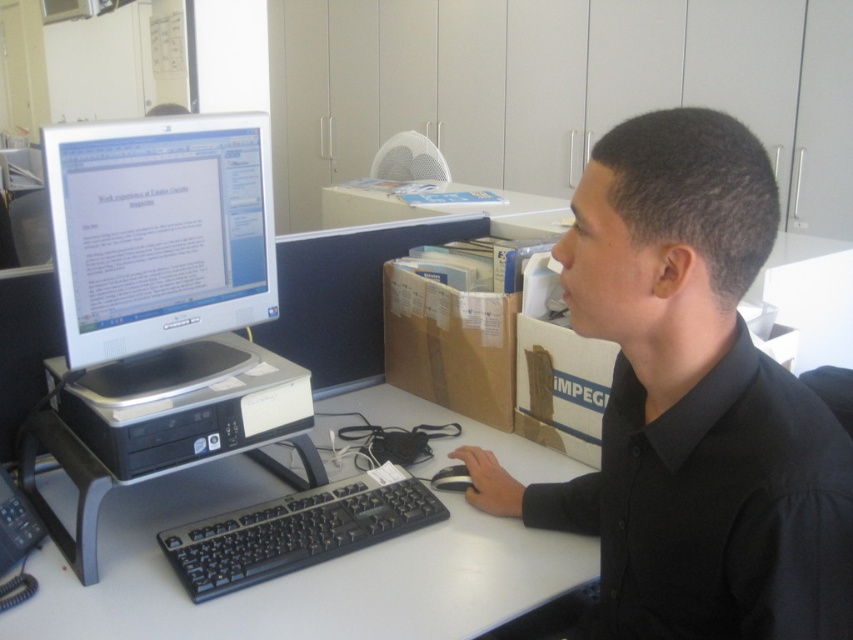
Based on the photo, can you confirm if black plastic computer desk at center is positioned to the left of black rubber mouse at center?

Indeed, black plastic computer desk at center is positioned on the left side of black rubber mouse at center.

Between point (94, 588) and point (460, 480), which one is positioned behind?

Point (460, 480)

Does point (138, 605) lie in front of point (457, 490)?

Yes, it is in front of point (457, 490).

The width and height of the screenshot is (853, 640). In order to click on black plastic computer desk at center in this screenshot , I will do `click(297, 573)`.

Which is more to the right, white glossy monitor at center or black matte keyboard at center?

From the viewer's perspective, black matte keyboard at center appears more on the right side.

You are a GUI agent. You are given a task and a screenshot of the screen. Output one action in this format:
    pyautogui.click(x=<x>, y=<y>)
    Task: Click on the white glossy monitor at center
    
    Given the screenshot: What is the action you would take?
    pyautogui.click(x=160, y=230)

Is point (397, 502) more distant than point (445, 484)?

No.

Locate an element on the screen. black matte keyboard at center is located at coordinates (297, 531).